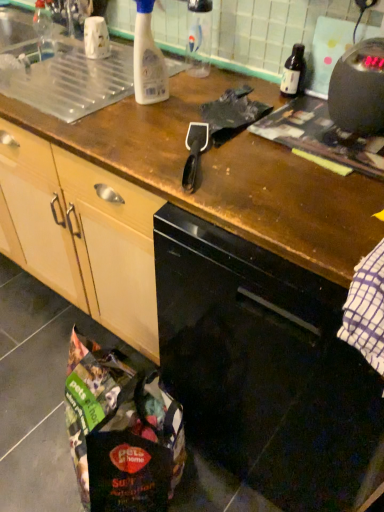
Question: Considering the relative sizes of black plastic spatula at center and black glossy dishwasher at center in the image provided, is black plastic spatula at center wider than black glossy dishwasher at center?

Choices:
 (A) yes
 (B) no

Answer: (B)

Question: Is black plastic spatula at center to the right of black glossy dishwasher at center from the viewer's perspective?

Choices:
 (A) no
 (B) yes

Answer: (A)

Question: Can you confirm if black plastic spatula at center is smaller than black glossy dishwasher at center?

Choices:
 (A) no
 (B) yes

Answer: (B)

Question: Is black plastic spatula at center facing towards black glossy dishwasher at center?

Choices:
 (A) no
 (B) yes

Answer: (A)

Question: Is black plastic spatula at center far away from black glossy dishwasher at center?

Choices:
 (A) yes
 (B) no

Answer: (B)

Question: Does black plastic spatula at center lie behind black glossy dishwasher at center?

Choices:
 (A) no
 (B) yes

Answer: (B)

Question: Considering the relative positions of black plastic kettle at upper right and black plastic spatula at center in the image provided, is black plastic kettle at upper right to the right of black plastic spatula at center from the viewer's perspective?

Choices:
 (A) no
 (B) yes

Answer: (B)

Question: From the image's perspective, would you say black plastic kettle at upper right is shown under black plastic spatula at center?

Choices:
 (A) no
 (B) yes

Answer: (A)

Question: Considering the relative sizes of black plastic kettle at upper right and black plastic spatula at center in the image provided, is black plastic kettle at upper right thinner than black plastic spatula at center?

Choices:
 (A) no
 (B) yes

Answer: (B)

Question: From the image's perspective, is black plastic kettle at upper right over black plastic spatula at center?

Choices:
 (A) no
 (B) yes

Answer: (B)

Question: Is black plastic spatula at center a part of black plastic kettle at upper right?

Choices:
 (A) no
 (B) yes

Answer: (A)

Question: Is black plastic kettle at upper right looking in the opposite direction of black plastic spatula at center?

Choices:
 (A) no
 (B) yes

Answer: (A)

Question: Are transparent plastic bottle at upper center, the 2th bottle from the left, and black glossy dishwasher at center beside each other?

Choices:
 (A) no
 (B) yes

Answer: (A)